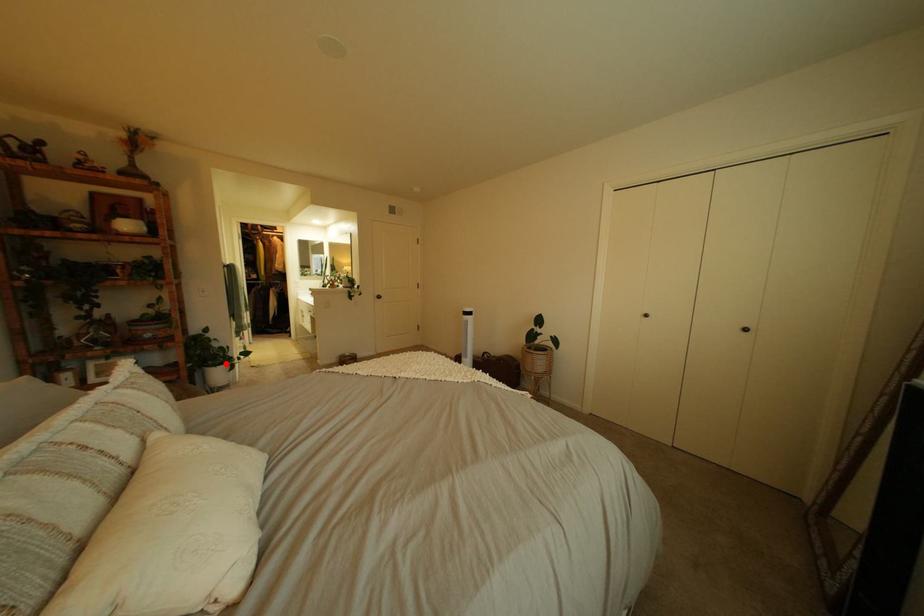
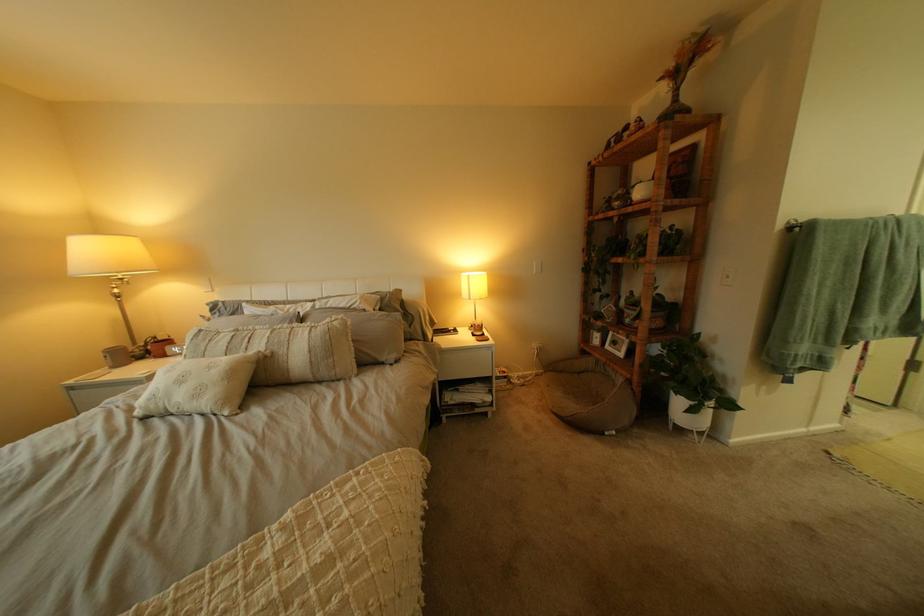
In the second image, find the point that corresponds to the highlighted location in the first image.

(687, 385)